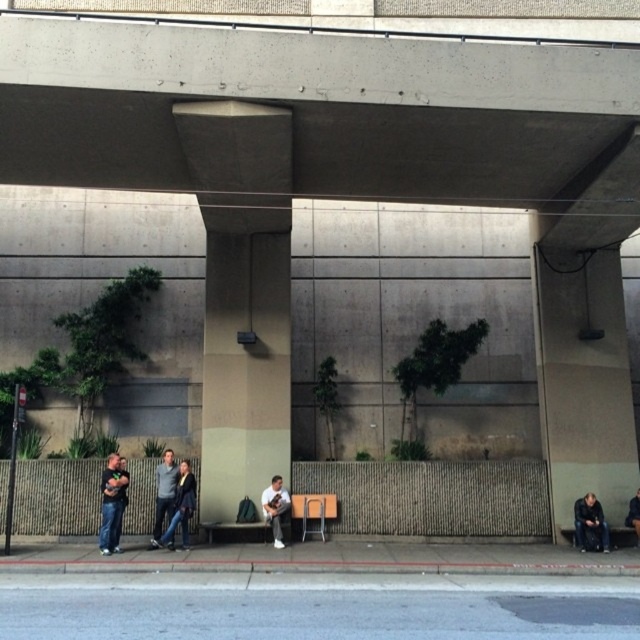
You are a photographer setting up a tripod in this urban scene under the overpass. You need to position your equipment so that it doesn not block the view of the dark gray sweater at center and the dark gray pants at lower right. Which object should you place your tripod closer to so that it remains visible without obstruction?

The dark gray sweater at center is taller than the dark gray pants at lower right. To ensure both are visible without obstruction, position the tripod closer to the dark gray pants at lower right since the sweater is taller and less likely to be blocked by the tripod placed near the shorter pants.

You are a photographer trying to capture a person wearing a dark gray sweater at center and dark gray pants at lower right. If you want to ensure both items are visible in the frame, which clothing item should you focus on first to avoid cropping?

The dark gray sweater at center has a larger width than the dark gray pants at lower right, so focusing on the dark gray sweater at center first would ensure it fits within the frame, allowing space for the smaller dark gray pants at lower right.

You are standing under the overpass and see a dark gray hoodie at lower left and a dark blue jacket at lower right. Which clothing item is closer to you?

The dark gray hoodie at lower left is closer to you because it is in front of the dark blue jacket at lower right.